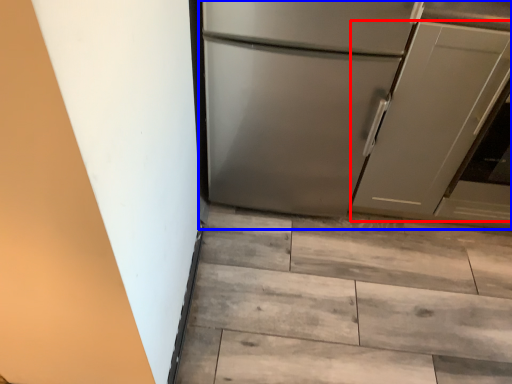
Question: Among these objects, which one is farthest to the camera, door (highlighted by a red box) or refrigerator (highlighted by a blue box)?

Choices:
 (A) door
 (B) refrigerator

Answer: (A)